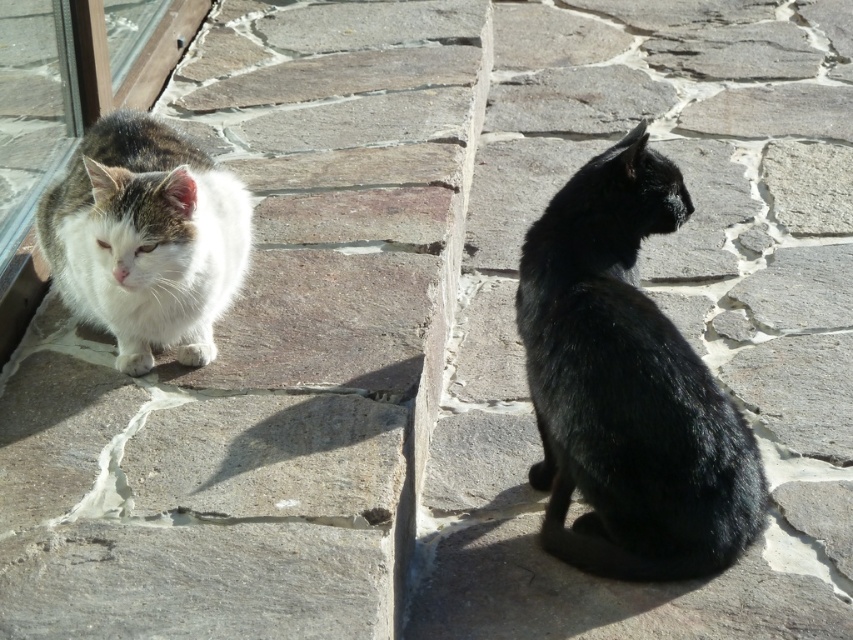
You are a photographer trying to capture both cats in a single frame. Given that the shiny black cat at center is blocking the view of the white fluffy cat at left, can you determine which cat you should move to ensure both are visible?

Since the shiny black cat at center is larger in size than the white fluffy cat at left, moving the smaller white fluffy cat at left might be easier to ensure both are visible in the frame.

In the scene shown: You are trying to decide which cat to adopt between the shiny black cat at center and the white fluffy cat at left. Based on their sizes, which one might be more suitable for a home with small children?

The shiny black cat at center might be wider than the white fluffy cat at left, so it could be a better fit for a home with small children as its size may make it more tolerant of handling.